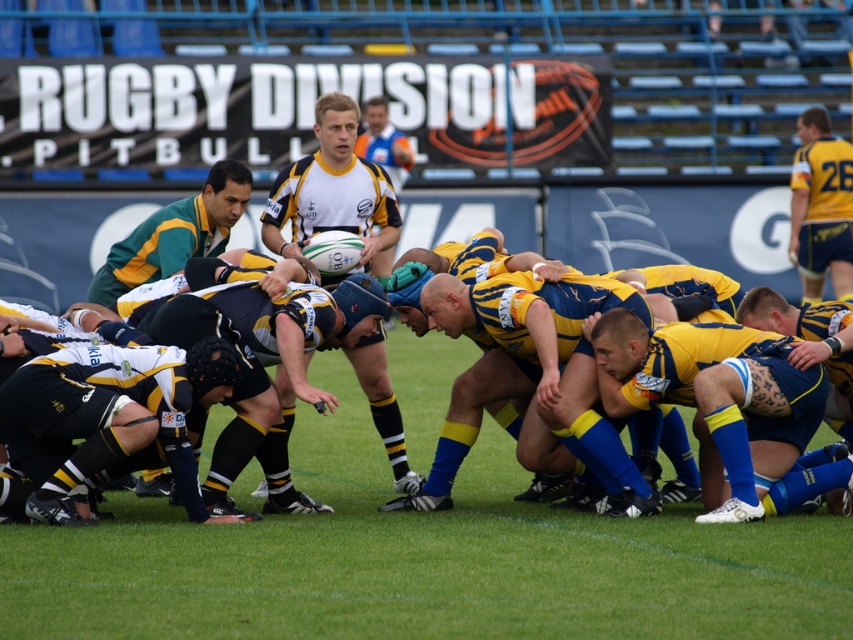
Question: Which point appears closest to the camera in this image?

Choices:
 (A) [274, 193]
 (B) [822, 259]

Answer: (A)

Question: Estimate the real-world distances between objects in this image. Which object is closer to the yellow jersey at right?

Choices:
 (A) yellow and black jersey at center
 (B) blue matte shorts at center

Answer: (A)

Question: Among these objects, which one is farthest from the camera?

Choices:
 (A) blue matte shorts at center
 (B) yellow and black jersey at center
 (C) yellow jersey at center

Answer: (C)

Question: Does white matte rugby ball at center appear on the right side of yellow jersey at center?

Choices:
 (A) no
 (B) yes

Answer: (B)

Question: Is white matte rugby ball at center further to the viewer compared to yellow jersey at right?

Choices:
 (A) yes
 (B) no

Answer: (B)

Question: Does white matte rugby ball at center appear on the left side of yellow jersey at center?

Choices:
 (A) no
 (B) yes

Answer: (A)